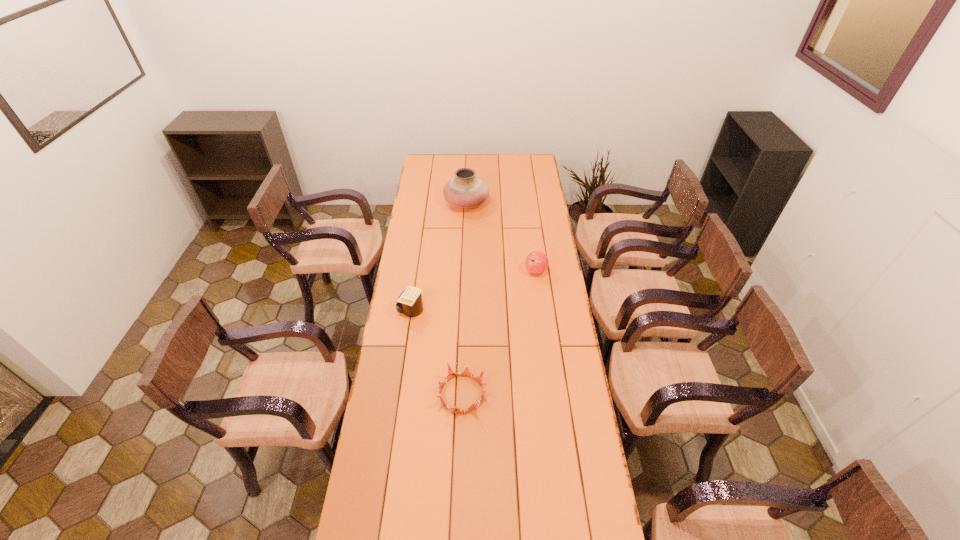
Image resolution: width=960 pixels, height=540 pixels. I want to click on free space located on the right of the leftmost object, so click(482, 310).

Where is `free space located on the front of the nearest object`? Image resolution: width=960 pixels, height=540 pixels. free space located on the front of the nearest object is located at coordinates (461, 429).

Locate an element on the screen. The image size is (960, 540). object located at the left edge is located at coordinates (409, 302).

This screenshot has width=960, height=540. I want to click on object that is at the right edge, so click(536, 262).

In the image, there is a desktop. Where is `vacant region at the far edge`? vacant region at the far edge is located at coordinates (465, 158).

What are the coordinates of `blank space at the left edge of the desktop` in the screenshot? It's located at (407, 422).

Where is `free space at the right edge of the desktop`? free space at the right edge of the desktop is located at coordinates (554, 285).

This screenshot has height=540, width=960. I want to click on blank area at the far right corner, so click(539, 159).

This screenshot has width=960, height=540. Identify the location of free spot between the third nearest object and the shortest object. (499, 333).

The width and height of the screenshot is (960, 540). Identify the location of vacant space that's between the pottery and the calculator. (439, 256).